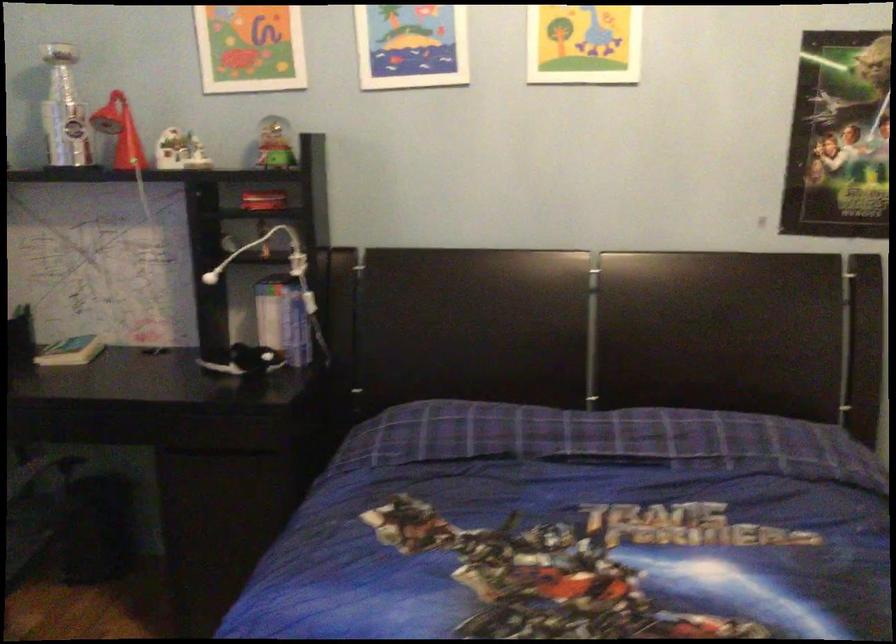
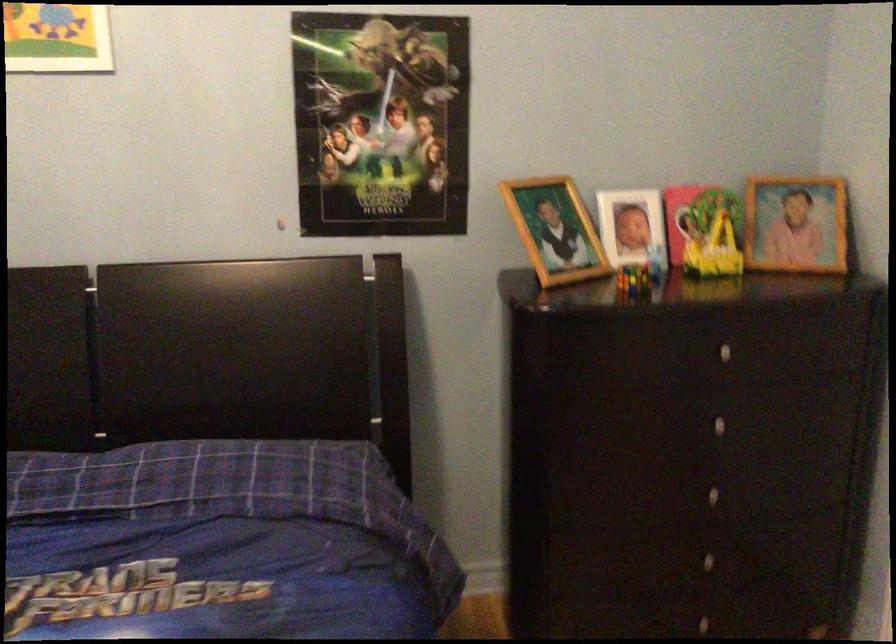
Question: In a continuous first-person perspective shot, in which direction is the camera moving?

Choices:
 (A) Left
 (B) Right
 (C) Forward
 (D) Backward

Answer: (B)